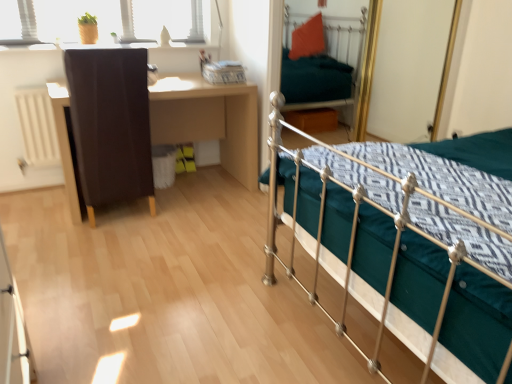
You are a GUI agent. You are given a task and a screenshot of the screen. Output one action in this format:
    pyautogui.click(x=<x>, y=<y>)
    Task: Click on the free space in front of brown wooden desk at left
    
    Given the screenshot: What is the action you would take?
    pyautogui.click(x=150, y=251)